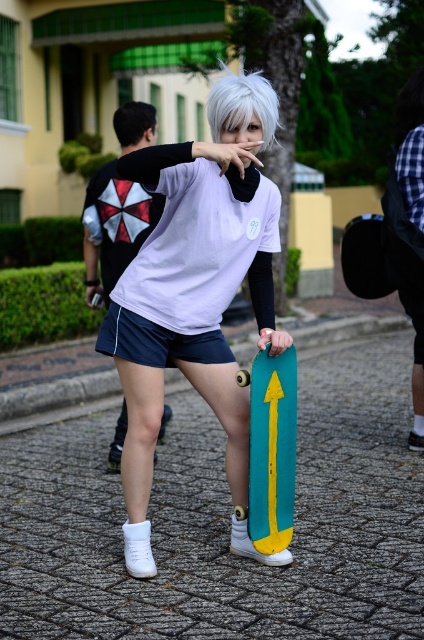
Question: Which of the following is the farthest from the observer?

Choices:
 (A) white matte t-shirt at center
 (B) black matte hair at upper left
 (C) white matte wig at center
 (D) cobblestone pavement at center

Answer: (B)

Question: Does cobblestone pavement at center have a larger size compared to teal matte skateboard at center?

Choices:
 (A) yes
 (B) no

Answer: (B)

Question: Which of the following is the closest to the observer?

Choices:
 (A) (229, 72)
 (B) (240, 163)
 (C) (125, 355)
 (D) (276, 406)

Answer: (B)

Question: Among these objects, which one is farthest from the camera?

Choices:
 (A) white matte wig at center
 (B) white matte t-shirt at center

Answer: (A)

Question: Is the position of cobblestone pavement at center less distant than that of black matte hair at upper left?

Choices:
 (A) yes
 (B) no

Answer: (A)

Question: Does navy blue fabric shorts at center have a smaller size compared to black matte hair at upper left?

Choices:
 (A) yes
 (B) no

Answer: (B)